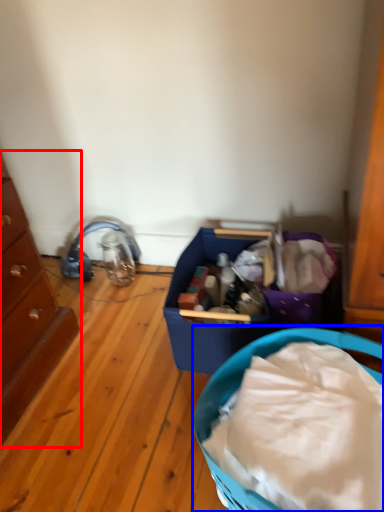
Question: Which point is closer to the camera, chest of drawers (highlighted by a red box) or basket container (highlighted by a blue box)?

Choices:
 (A) chest of drawers
 (B) basket container

Answer: (B)